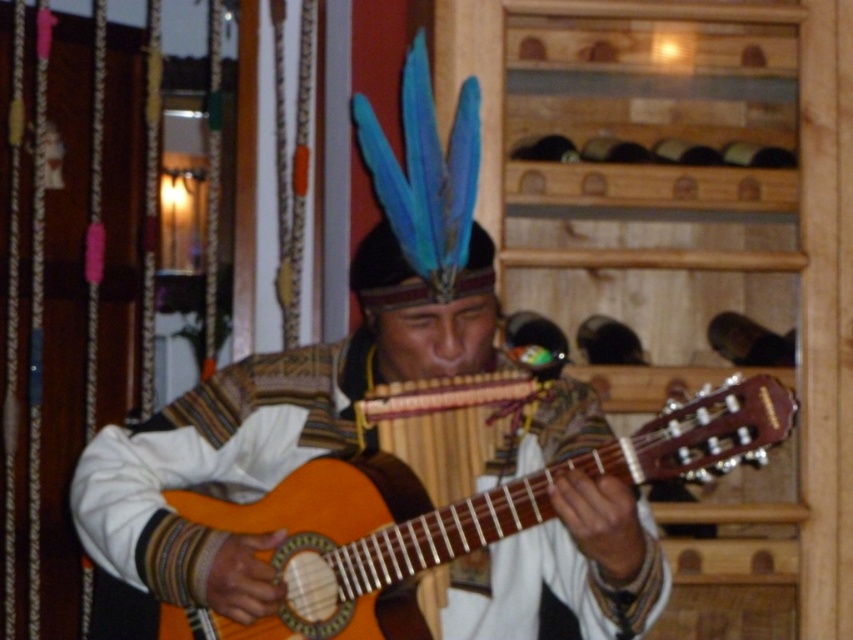
You are a photographer setting up a shoot with two guitars. You have the wooden guitar at center and the wooden acoustic guitar at center. Which guitar should you focus on if you want to capture the one that is visually dominant in the composition?

The wooden guitar at center is positioned over the wooden acoustic guitar at center, making it the visually dominant one to focus on.

You are a musician who needs to choose between the wooden guitar at center and the wooden acoustic guitar at center for a performance. Based on their sizes, which one would you recommend for easier handling during a dance routine?

The wooden acoustic guitar at center is smaller in size compared to the wooden guitar at center, making it easier to handle during a dance routine.

You are a photographer trying to capture the musician playing the wooden guitar at center and the wooden acoustic guitar at center. Which guitar should you focus on first if you want to emphasize the one closer to you?

The wooden guitar at center is closer to you, so you should focus on it first to emphasize its proximity.